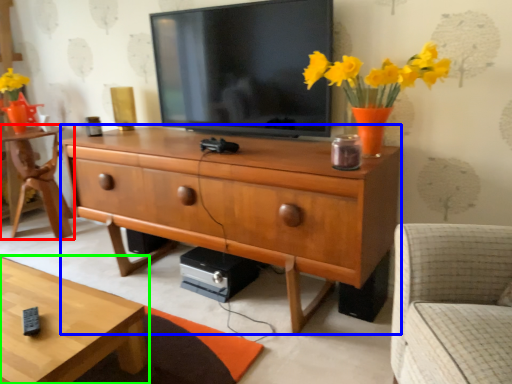
Question: Based on their relative distances, which object is farther from desk (highlighted by a red box)? Choose from chest of drawers (highlighted by a blue box) and coffee table (highlighted by a green box).

Choices:
 (A) chest of drawers
 (B) coffee table

Answer: (B)